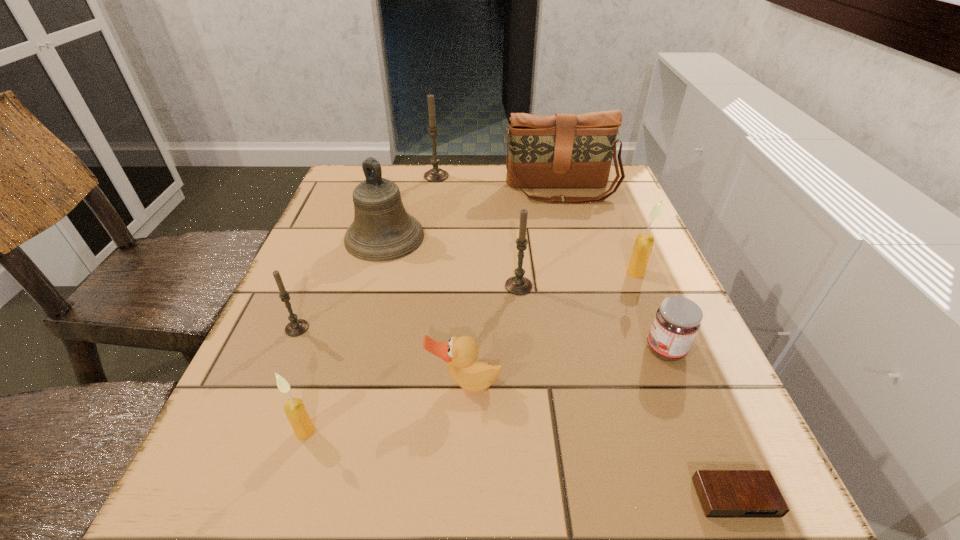
Locate an element on the screen. the nearer cream candle is located at coordinates (295, 411).

Where is `the ninth farthest object`? the ninth farthest object is located at coordinates (295, 411).

Where is `tan duck`? Image resolution: width=960 pixels, height=540 pixels. tan duck is located at coordinates (460, 354).

Locate an element on the screen. The height and width of the screenshot is (540, 960). the eighth farthest object is located at coordinates (460, 354).

At what (x,y) coordinates should I click in order to perform the action: click on red jam. Please return your answer as a coordinate pair (x, y). This screenshot has width=960, height=540. Looking at the image, I should click on (677, 321).

You are a GUI agent. You are given a task and a screenshot of the screen. Output one action in this format:
    pyautogui.click(x=<x>, y=<y>)
    Task: Click on the black alarm clock
    
    Given the screenshot: What is the action you would take?
    pyautogui.click(x=722, y=493)

This screenshot has width=960, height=540. Find the location of `alarm clock`. alarm clock is located at coordinates (722, 493).

In order to click on blank space located 0.330m on the front of the farthest gray candle in this screenshot , I will do `click(423, 259)`.

Find the location of `free space located on the front-facing side of the shoulder bag`. free space located on the front-facing side of the shoulder bag is located at coordinates click(595, 321).

I want to click on vacant space located 0.120m on the back of the third farthest object, so click(x=397, y=190).